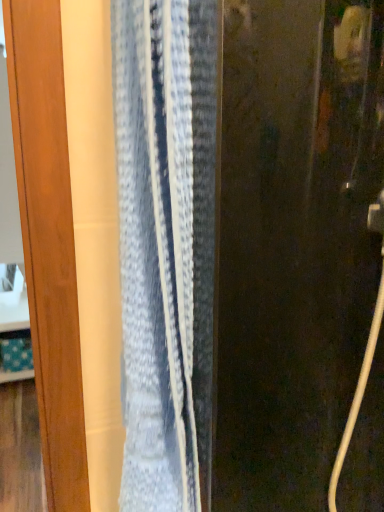
What do you see at coordinates (358, 392) in the screenshot? The image size is (384, 512). I see `white matte cord at right` at bounding box center [358, 392].

Where is `white matte cord at right`? This screenshot has height=512, width=384. white matte cord at right is located at coordinates (358, 392).

Locate an element on the screen. The height and width of the screenshot is (512, 384). white matte cord at right is located at coordinates tap(358, 392).